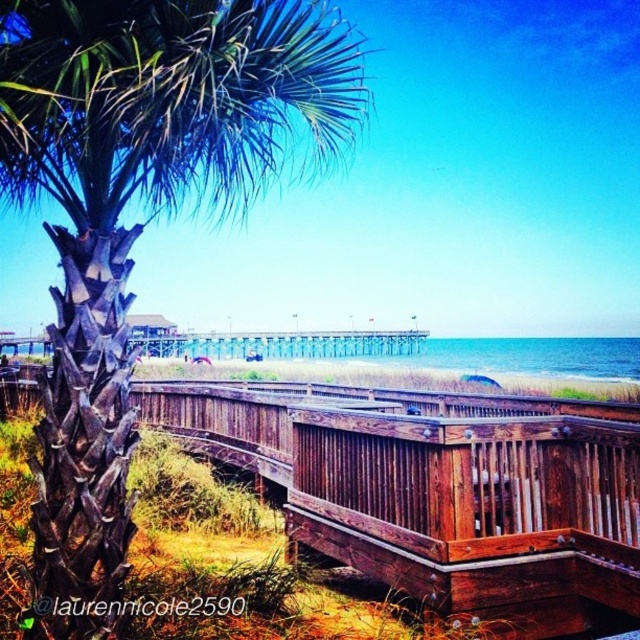
Question: Which point appears farthest from the camera in this image?

Choices:
 (A) (394, 417)
 (B) (96, 202)
 (C) (436, 355)

Answer: (C)

Question: Does dark brown textured palm tree at left have a greater width compared to brown wooden deck at center?

Choices:
 (A) yes
 (B) no

Answer: (A)

Question: Which of the following is the farthest from the observer?

Choices:
 (A) pos(17,124)
 (B) pos(362,416)
 (C) pos(248,344)

Answer: (C)

Question: Among these points, which one is nearest to the camera?

Choices:
 (A) (70, 474)
 (B) (525, 413)
 (C) (570, 353)

Answer: (A)

Question: Does dark brown textured palm tree at left appear under blue water at center?

Choices:
 (A) no
 (B) yes

Answer: (A)

Question: Does dark brown textured palm tree at left have a larger size compared to blue water at center?

Choices:
 (A) yes
 (B) no

Answer: (B)